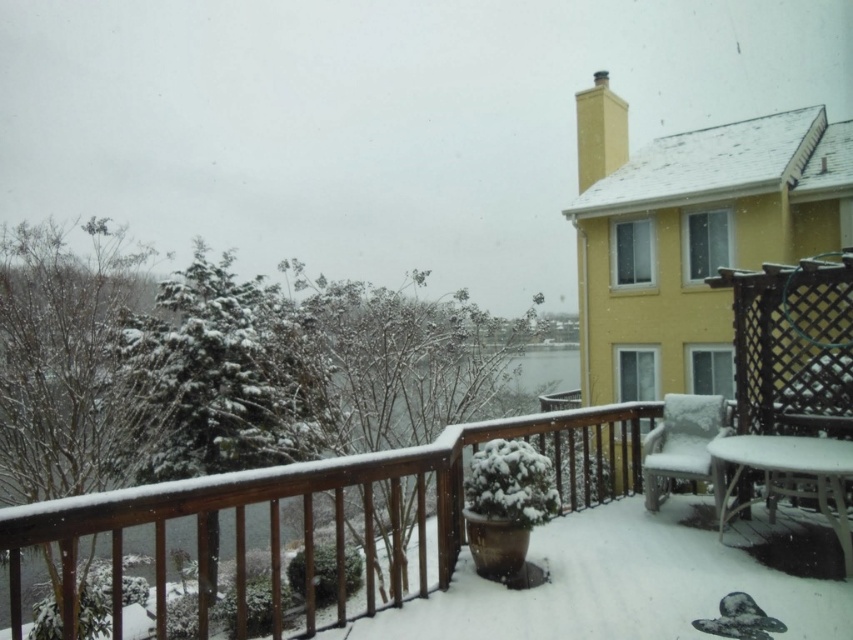
You are standing on the balcony and want to place a small snowman decoration on the closest object to you between the white glossy table at lower right and the white fluffy chair at lower right. Which object should you choose?

The white glossy table at lower right is closer to the viewer than the white fluffy chair at lower right, so you should place the snowman decoration on the white glossy table at lower right.

You are standing at the camera position and want to place a 4.5 meter long ladder from the camera to the white glossy table at lower right. Is this possible?

The distance between the camera and the white glossy table at lower right is 4.34 meters. Since the ladder is 4.5 meters long, it is slightly too long to fit between them. Therefore, placing the ladder from the camera to the white glossy table at lower right is not possible.